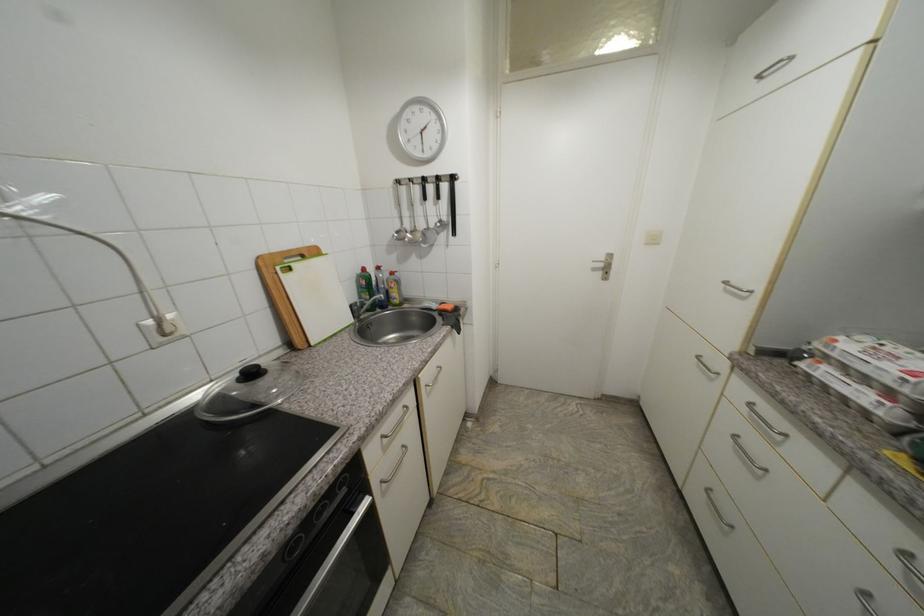
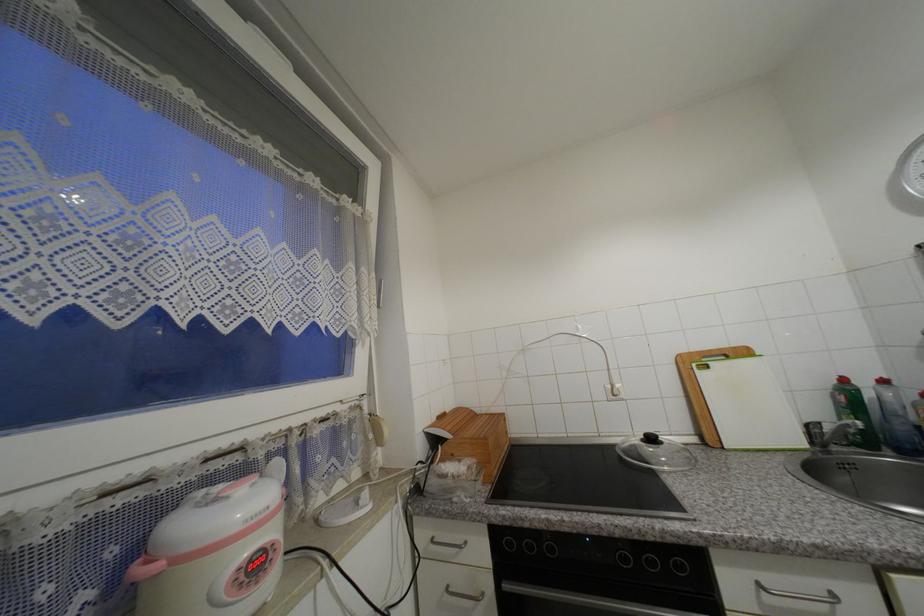
Find the pixel in the second image that matches point (370, 270) in the first image.

(849, 381)